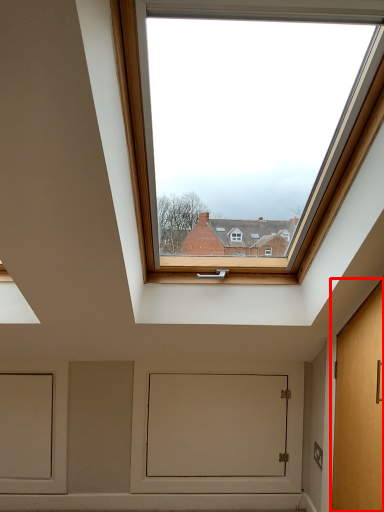
Question: Observing the image, what is the correct spatial positioning of door (annotated by the red box) in reference to window screen?

Choices:
 (A) right
 (B) left

Answer: (A)